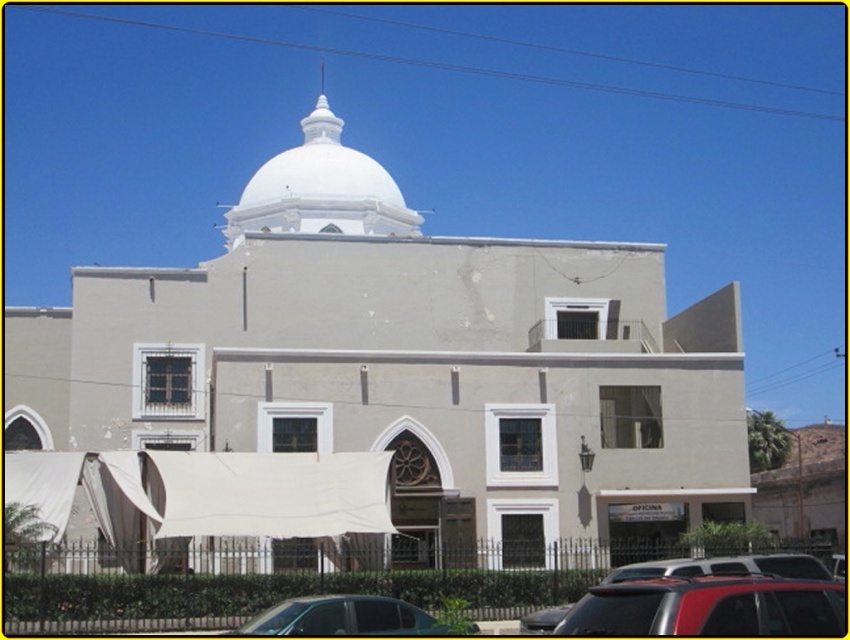
Question: Which of the following is the closest to the observer?

Choices:
 (A) white smooth dome at upper center
 (B) red matte suv at lower right
 (C) white concrete church at center

Answer: (B)

Question: Is white smooth dome at upper center closer to camera compared to metallic silver car at lower center?

Choices:
 (A) no
 (B) yes

Answer: (A)

Question: Can you confirm if red matte suv at lower right is thinner than metallic silver car at lower center?

Choices:
 (A) no
 (B) yes

Answer: (B)

Question: Which object appears closest to the camera in this image?

Choices:
 (A) white concrete church at center
 (B) white smooth dome at upper center
 (C) red matte suv at lower right
 (D) metallic silver car at lower center

Answer: (C)

Question: Which of the following is the closest to the observer?

Choices:
 (A) (316, 97)
 (B) (672, 605)
 (C) (318, 612)
 (D) (26, 410)

Answer: (B)

Question: Can you confirm if white concrete church at center is wider than white smooth dome at upper center?

Choices:
 (A) no
 (B) yes

Answer: (B)